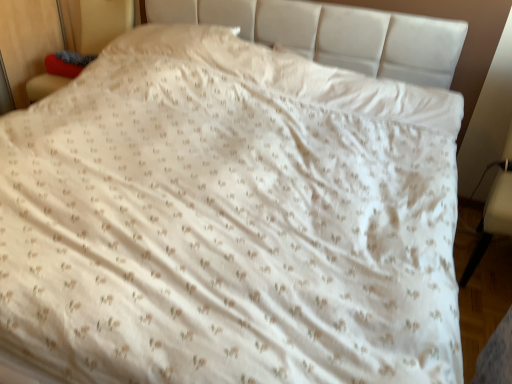
This screenshot has width=512, height=384. What do you see at coordinates (494, 208) in the screenshot? I see `white leather armchair at lower right, the second armchair in the left-to-right sequence` at bounding box center [494, 208].

The height and width of the screenshot is (384, 512). Identify the location of white leather armchair at lower right, the 2th armchair viewed from the top. (494, 208).

Locate an element on the screen. matte red cushion at left, which is the first armchair in top-to-bottom order is located at coordinates (95, 23).

Image resolution: width=512 pixels, height=384 pixels. What do you see at coordinates (95, 23) in the screenshot?
I see `matte red cushion at left, the first armchair in the left-to-right sequence` at bounding box center [95, 23].

Image resolution: width=512 pixels, height=384 pixels. In order to click on white leather armchair at lower right, which is counted as the 1th armchair, starting from the right in this screenshot , I will do `click(494, 208)`.

Which is more to the right, matte red cushion at left, which is the 2th armchair in bottom-to-top order, or white leather armchair at lower right, the first armchair when ordered from bottom to top?

white leather armchair at lower right, the first armchair when ordered from bottom to top, is more to the right.

Is matte red cushion at left, which is the 2th armchair in bottom-to-top order, behind white leather armchair at lower right, the 2th armchair viewed from the top?

Yes.

Which point is more distant from viewer, (121, 13) or (494, 204)?

Point (121, 13)

From the image's perspective, would you say matte red cushion at left, which is the 2th armchair in bottom-to-top order, is positioned over white leather armchair at lower right, the second armchair in the left-to-right sequence?

Yes, from the image's perspective, matte red cushion at left, which is the 2th armchair in bottom-to-top order, is over white leather armchair at lower right, the second armchair in the left-to-right sequence.

From a real-world perspective, is matte red cushion at left, the first armchair in the left-to-right sequence, located higher than white leather armchair at lower right, which is counted as the 1th armchair, starting from the right?

Yes, from a real-world perspective, matte red cushion at left, the first armchair in the left-to-right sequence, is above white leather armchair at lower right, which is counted as the 1th armchair, starting from the right.

Considering the sizes of matte red cushion at left, which is the 2th armchair in bottom-to-top order, and white leather armchair at lower right, the second armchair in the left-to-right sequence, in the image, is matte red cushion at left, which is the 2th armchair in bottom-to-top order, wider or thinner than white leather armchair at lower right, the second armchair in the left-to-right sequence,?

In the image, matte red cushion at left, which is the 2th armchair in bottom-to-top order, appears to be more narrow than white leather armchair at lower right, the second armchair in the left-to-right sequence.

In the scene shown: Considering the relative sizes of matte red cushion at left, which is the 2th armchair in bottom-to-top order, and white leather armchair at lower right, the first armchair when ordered from bottom to top, in the image provided, is matte red cushion at left, which is the 2th armchair in bottom-to-top order, taller than white leather armchair at lower right, the first armchair when ordered from bottom to top,?

Incorrect, the height of matte red cushion at left, which is the 2th armchair in bottom-to-top order, is not larger of that of white leather armchair at lower right, the first armchair when ordered from bottom to top.

Considering the sizes of matte red cushion at left, the second armchair in the right-to-left sequence, and white leather armchair at lower right, which is counted as the 1th armchair, starting from the right, in the image, is matte red cushion at left, the second armchair in the right-to-left sequence, bigger or smaller than white leather armchair at lower right, which is counted as the 1th armchair, starting from the right,?

matte red cushion at left, the second armchair in the right-to-left sequence, is bigger than white leather armchair at lower right, which is counted as the 1th armchair, starting from the right.

Would you say white leather armchair at lower right, the first armchair when ordered from bottom to top, is part of matte red cushion at left, which is the first armchair in top-to-bottom order,'s contents?

That's incorrect, white leather armchair at lower right, the first armchair when ordered from bottom to top, is not inside matte red cushion at left, which is the first armchair in top-to-bottom order.

Consider the image. Is matte red cushion at left, which is the first armchair in top-to-bottom order, with white leather armchair at lower right, the 2th armchair viewed from the top?

No, matte red cushion at left, which is the first armchair in top-to-bottom order, is not next to white leather armchair at lower right, the 2th armchair viewed from the top.

Is matte red cushion at left, which is the 2th armchair in bottom-to-top order, turned away from white leather armchair at lower right, the first armchair when ordered from bottom to top?

No, white leather armchair at lower right, the first armchair when ordered from bottom to top, is not at the back of matte red cushion at left, which is the 2th armchair in bottom-to-top order.

What's the angular difference between matte red cushion at left, the first armchair in the left-to-right sequence, and white leather armchair at lower right, which is counted as the 1th armchair, starting from the right,'s facing directions?

The angular difference between matte red cushion at left, the first armchair in the left-to-right sequence, and white leather armchair at lower right, which is counted as the 1th armchair, starting from the right, is 0.896 degrees.

Where is `armchair in front of the matte red cushion at left, which is the first armchair in top-to-bottom order`? The height and width of the screenshot is (384, 512). armchair in front of the matte red cushion at left, which is the first armchair in top-to-bottom order is located at coordinates (494, 208).

Which is more to the left, white leather armchair at lower right, which is counted as the 1th armchair, starting from the right, or matte red cushion at left, the second armchair in the right-to-left sequence?

matte red cushion at left, the second armchair in the right-to-left sequence.

Between white leather armchair at lower right, which is counted as the 1th armchair, starting from the right, and matte red cushion at left, which is the first armchair in top-to-bottom order, which one is positioned in front?

white leather armchair at lower right, which is counted as the 1th armchair, starting from the right.

Is point (485, 233) farther from viewer compared to point (46, 94)?

That is False.

From the image's perspective, is white leather armchair at lower right, the second armchair in the left-to-right sequence, under matte red cushion at left, the first armchair in the left-to-right sequence?

Correct, white leather armchair at lower right, the second armchair in the left-to-right sequence, appears lower than matte red cushion at left, the first armchair in the left-to-right sequence, in the image.

From a real-world perspective, between white leather armchair at lower right, the 2th armchair viewed from the top, and matte red cushion at left, the first armchair in the left-to-right sequence, who is vertically lower?

white leather armchair at lower right, the 2th armchair viewed from the top, is physically lower.

Between white leather armchair at lower right, the first armchair when ordered from bottom to top, and matte red cushion at left, which is the first armchair in top-to-bottom order, which one has smaller width?

matte red cushion at left, which is the first armchair in top-to-bottom order, is thinner.

Is white leather armchair at lower right, the second armchair in the left-to-right sequence, taller than matte red cushion at left, which is the first armchair in top-to-bottom order?

Correct, white leather armchair at lower right, the second armchair in the left-to-right sequence, is much taller as matte red cushion at left, which is the first armchair in top-to-bottom order.

Considering the sizes of objects white leather armchair at lower right, the second armchair in the left-to-right sequence, and matte red cushion at left, the first armchair in the left-to-right sequence, in the image provided, who is smaller, white leather armchair at lower right, the second armchair in the left-to-right sequence, or matte red cushion at left, the first armchair in the left-to-right sequence,?

white leather armchair at lower right, the second armchair in the left-to-right sequence.

Could matte red cushion at left, which is the first armchair in top-to-bottom order, be considered to be inside white leather armchair at lower right, which is counted as the 1th armchair, starting from the right?

No, matte red cushion at left, which is the first armchair in top-to-bottom order, is not surrounded by white leather armchair at lower right, which is counted as the 1th armchair, starting from the right.

Is white leather armchair at lower right, the 2th armchair viewed from the top, next to matte red cushion at left, the second armchair in the right-to-left sequence?

No, white leather armchair at lower right, the 2th armchair viewed from the top, is not touching matte red cushion at left, the second armchair in the right-to-left sequence.

Does white leather armchair at lower right, which is counted as the 1th armchair, starting from the right, turn towards matte red cushion at left, which is the first armchair in top-to-bottom order?

No, white leather armchair at lower right, which is counted as the 1th armchair, starting from the right, is not facing towards matte red cushion at left, which is the first armchair in top-to-bottom order.

Identify the location of armchair below the matte red cushion at left, which is the 2th armchair in bottom-to-top order (from the image's perspective). This screenshot has height=384, width=512. (494, 208).

The width and height of the screenshot is (512, 384). Identify the location of armchair to the left of white leather armchair at lower right, the 2th armchair viewed from the top. (95, 23).

You are a GUI agent. You are given a task and a screenshot of the screen. Output one action in this format:
    pyautogui.click(x=<x>, y=<y>)
    Task: Click on the armchair behind the white leather armchair at lower right, the first armchair when ordered from bottom to top
    The height and width of the screenshot is (384, 512).
    Given the screenshot: What is the action you would take?
    pyautogui.click(x=95, y=23)